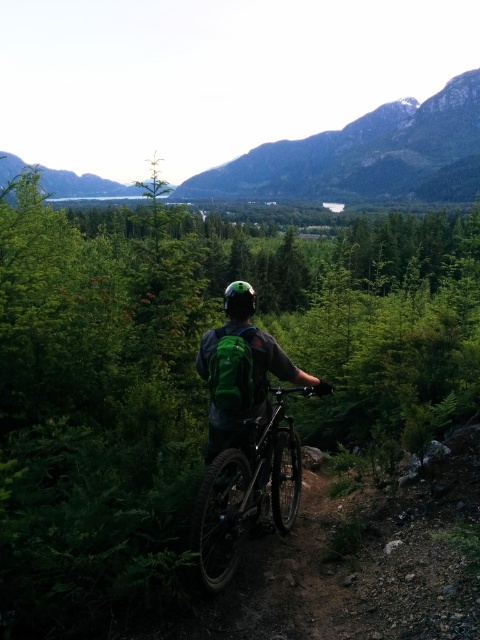
You are a hiker planning to take a photo of the green matte forest at center and the green matte backpack at center. Based on their positions, which object should you focus on first to ensure both are in the frame?

The green matte forest at center is above the green matte backpack at center, so you should focus on the green matte backpack at center first to ensure both are in the frame.

You are the cyclist in the image. You want to look at your backpack without moving your head. Which direction should you turn your eyes to see the green matte backpack at center from the green matte forest at center?

The green matte forest at center is to the right of the green matte backpack at center, so you should turn your eyes to the left to see the green matte backpack at center.

You are a photographer trying to capture a closeup of the shiny metallic bicycle at center and the green matte backpack at center in the scene. How far apart are these two items from each other?

The shiny metallic bicycle at center and the green matte backpack at center are 8.08 inches apart.